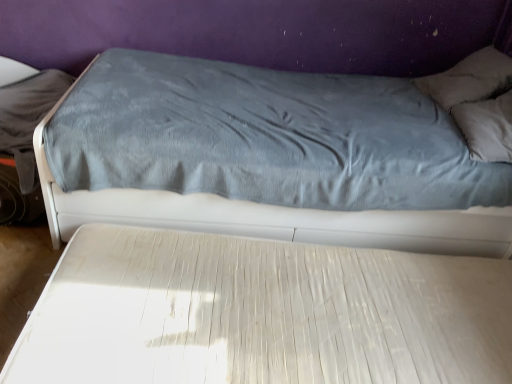
Question: Is gray soft pillow at upper right oriented away from white textured mattress at center, the first bed from the bottom?

Choices:
 (A) no
 (B) yes

Answer: (A)

Question: Considering the relative sizes of gray soft pillow at upper right and white textured mattress at center, the first bed from the bottom, in the image provided, is gray soft pillow at upper right shorter than white textured mattress at center, the first bed from the bottom,?

Choices:
 (A) yes
 (B) no

Answer: (B)

Question: From the image's perspective, is gray soft pillow at upper right beneath white textured mattress at center, the first bed from the bottom?

Choices:
 (A) no
 (B) yes

Answer: (A)

Question: Can you confirm if gray soft pillow at upper right is positioned to the left of white textured mattress at center, the first bed from the bottom?

Choices:
 (A) yes
 (B) no

Answer: (B)

Question: Is gray soft pillow at upper right taller than white textured mattress at center, the first bed from the bottom?

Choices:
 (A) yes
 (B) no

Answer: (A)

Question: In the image, is gray soft pillow at upper right on the left side or the right side of velvet blue bed at upper center, the 2th bed positioned from the bottom?

Choices:
 (A) right
 (B) left

Answer: (A)

Question: From the image's perspective, is gray soft pillow at upper right positioned above or below velvet blue bed at upper center, placed as the first bed when sorted from top to bottom?

Choices:
 (A) above
 (B) below

Answer: (A)

Question: Choose the correct answer: Is gray soft pillow at upper right inside velvet blue bed at upper center, the 2th bed positioned from the bottom, or outside it?

Choices:
 (A) outside
 (B) inside

Answer: (B)

Question: From their relative heights in the image, would you say gray soft pillow at upper right is taller or shorter than velvet blue bed at upper center, placed as the first bed when sorted from top to bottom?

Choices:
 (A) tall
 (B) short

Answer: (B)

Question: In terms of height, does velvet blue bed at upper center, the 2th bed positioned from the bottom, look taller or shorter compared to gray soft pillow at upper right?

Choices:
 (A) tall
 (B) short

Answer: (A)

Question: Does point (426, 221) appear closer or farther from the camera than point (501, 104)?

Choices:
 (A) farther
 (B) closer

Answer: (B)

Question: Is velvet blue bed at upper center, placed as the first bed when sorted from top to bottom, wider or thinner than gray soft pillow at upper right?

Choices:
 (A) thin
 (B) wide

Answer: (B)

Question: From a real-world perspective, relative to gray soft pillow at upper right, is velvet blue bed at upper center, placed as the first bed when sorted from top to bottom, vertically above or below?

Choices:
 (A) above
 (B) below

Answer: (B)

Question: Looking at the image, does white textured mattress at center, the first bed from the bottom, seem bigger or smaller compared to velvet blue bed at upper center, placed as the first bed when sorted from top to bottom?

Choices:
 (A) big
 (B) small

Answer: (B)

Question: Considering the relative positions of white textured mattress at center, the first bed from the bottom, and velvet blue bed at upper center, placed as the first bed when sorted from top to bottom, in the image provided, is white textured mattress at center, the first bed from the bottom, to the left or to the right of velvet blue bed at upper center, placed as the first bed when sorted from top to bottom,?

Choices:
 (A) right
 (B) left

Answer: (A)